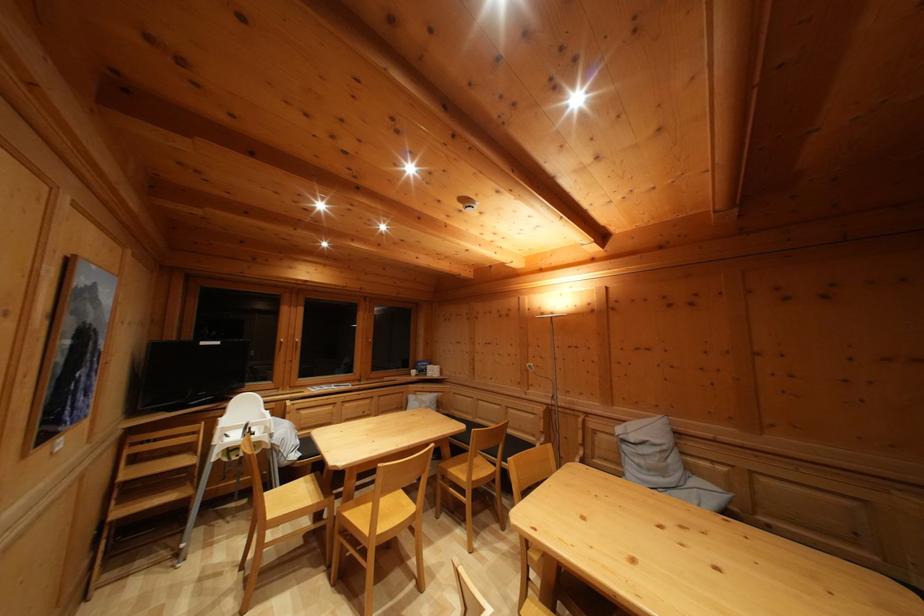
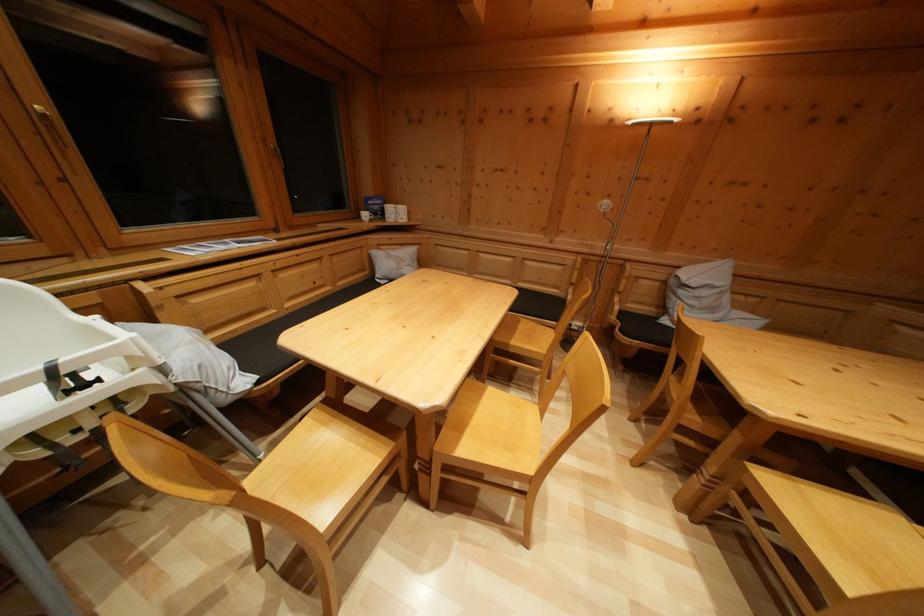
Find the pixel in the second image that matches point 329,506 in the first image.

(398, 451)